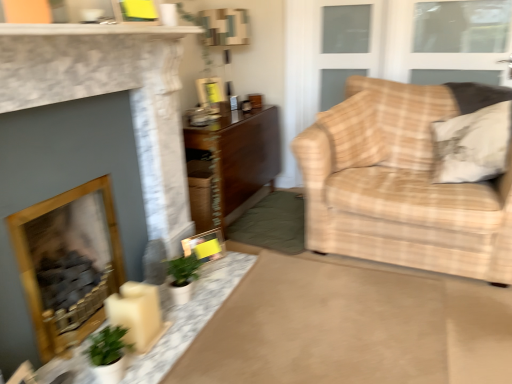
Question: Considering the relative sizes of wooden fireplace at left, which is the second fireplace from front to back, and wooden table at center, the second table when ordered from bottom to top, in the image provided, is wooden fireplace at left, which is the second fireplace from front to back, wider than wooden table at center, the second table when ordered from bottom to top,?

Choices:
 (A) no
 (B) yes

Answer: (A)

Question: Does wooden fireplace at left, the first fireplace positioned from the back, have a lesser width compared to wooden table at center, placed as the 1th table when sorted from back to front?

Choices:
 (A) no
 (B) yes

Answer: (B)

Question: From the image's perspective, is wooden fireplace at left, the first fireplace positioned from the back, above wooden table at center, placed as the second table when sorted from front to back?

Choices:
 (A) yes
 (B) no

Answer: (B)

Question: Is wooden fireplace at left, which is the second fireplace from front to back, taller than wooden table at center, the second table when ordered from bottom to top?

Choices:
 (A) yes
 (B) no

Answer: (B)

Question: Can you confirm if wooden fireplace at left, which is the second fireplace from front to back, is positioned to the left of wooden table at center, the second table when ordered from bottom to top?

Choices:
 (A) no
 (B) yes

Answer: (B)

Question: Is white marble mantle at upper center to the left or to the right of matte plastic picture frame at upper center, positioned as the 1th picture frame in back-to-front order, in the image?

Choices:
 (A) left
 (B) right

Answer: (A)

Question: Considering the positions of white marble mantle at upper center and matte plastic picture frame at upper center, placed as the first picture frame when sorted from top to bottom, in the image, is white marble mantle at upper center taller or shorter than matte plastic picture frame at upper center, placed as the first picture frame when sorted from top to bottom,?

Choices:
 (A) tall
 (B) short

Answer: (B)

Question: In the image, is white marble mantle at upper center positioned in front of or behind matte plastic picture frame at upper center, acting as the 2th picture frame starting from the bottom?

Choices:
 (A) front
 (B) behind

Answer: (A)

Question: From a real-world perspective, is white marble mantle at upper center above or below matte plastic picture frame at upper center, positioned as the 1th picture frame in back-to-front order?

Choices:
 (A) above
 (B) below

Answer: (A)

Question: Is white textured pillow at right in front of or behind white marble table at center, the 2th table positioned from the top, in the image?

Choices:
 (A) behind
 (B) front

Answer: (A)

Question: Considering the relative positions of white textured pillow at right and white marble table at center, the 2th table positioned from the top, in the image provided, is white textured pillow at right to the left or to the right of white marble table at center, the 2th table positioned from the top,?

Choices:
 (A) right
 (B) left

Answer: (A)

Question: Is white textured pillow at right situated inside white marble table at center, the 2th table positioned from the top, or outside?

Choices:
 (A) outside
 (B) inside

Answer: (A)

Question: From the image's perspective, relative to white marble table at center, marked as the 2th table in a back-to-front arrangement, is white textured pillow at right above or below?

Choices:
 (A) below
 (B) above

Answer: (B)

Question: Visually, is yellow paper picture frame at center, which is counted as the second picture frame, starting from the back, positioned to the left or to the right of white textured pillow at right?

Choices:
 (A) right
 (B) left

Answer: (B)

Question: Is point (193, 249) closer or farther from the camera than point (478, 112)?

Choices:
 (A) closer
 (B) farther

Answer: (A)